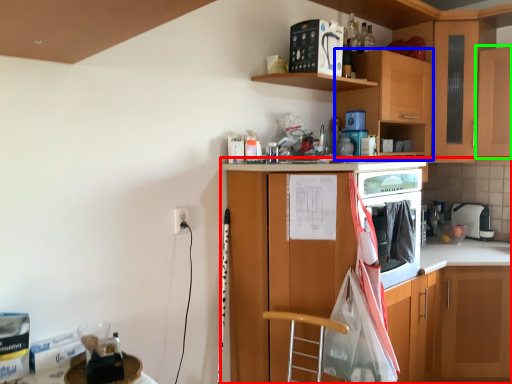
Question: Which object is the farthest from cabinetry (highlighted by a red box)? Choose among these: cabinetry (highlighted by a blue box) or cabinetry (highlighted by a green box).

Choices:
 (A) cabinetry
 (B) cabinetry

Answer: (B)